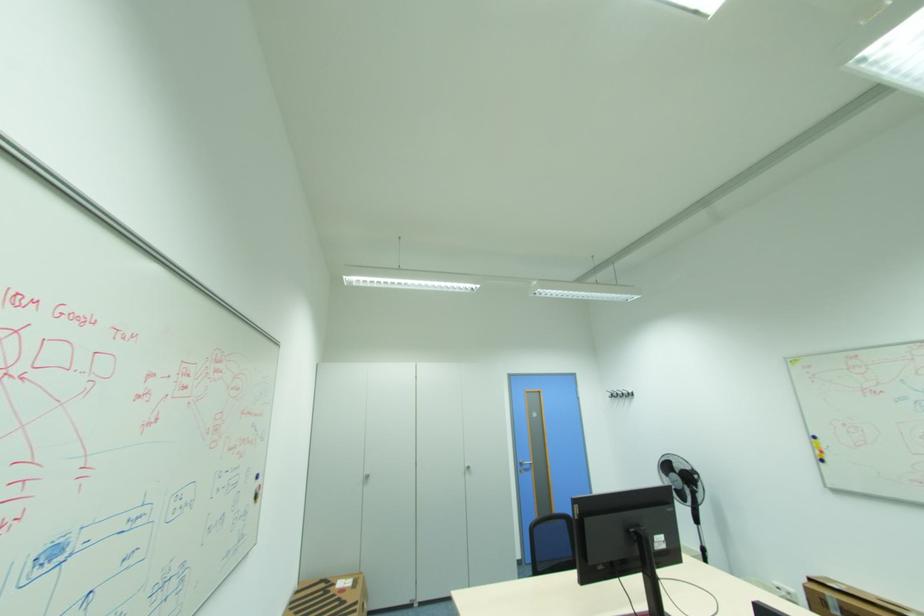
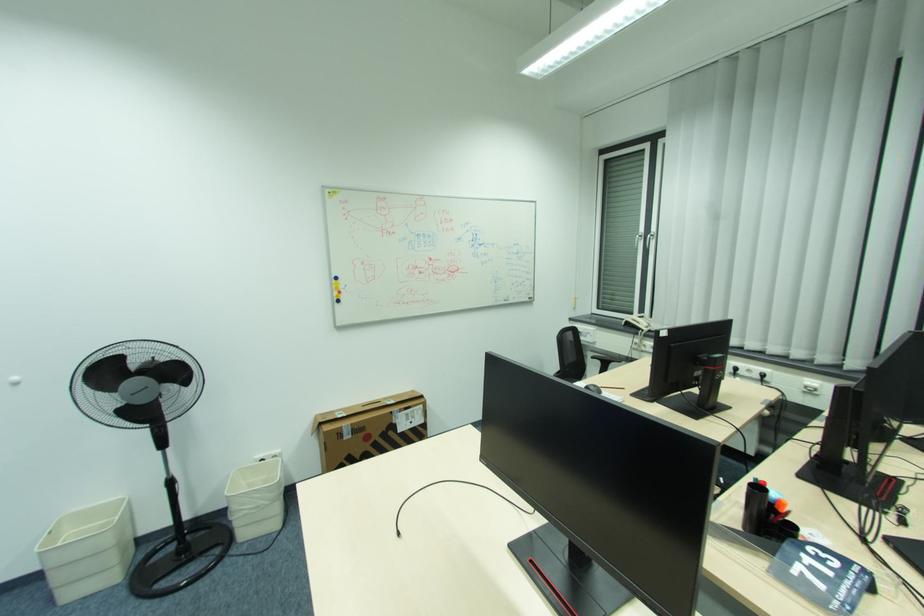
The point at (819, 440) is marked in the first image. Where is the corresponding point in the second image?

(339, 282)